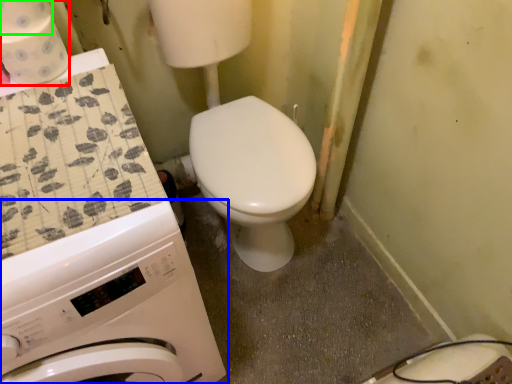
Question: Which object is positioned closest to toilet paper (highlighted by a red box)? Select from washing machine (highlighted by a blue box) and toilet paper (highlighted by a green box).

Choices:
 (A) washing machine
 (B) toilet paper

Answer: (B)